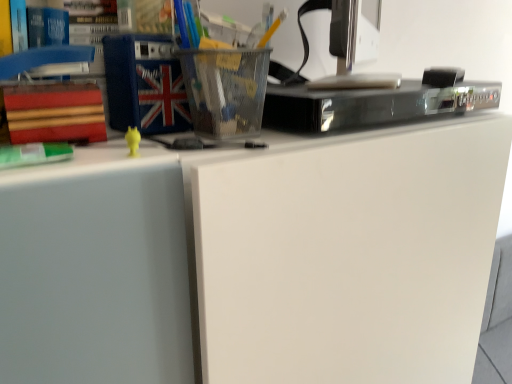
Question: From a real-world perspective, is blue fabric book at upper left, acting as the first paperback book starting from the top, above or below metallic silver desktop computer at upper right?

Choices:
 (A) above
 (B) below

Answer: (A)

Question: Looking at their shapes, would you say blue fabric book at upper left, the 2th paperback book when ordered from left to right, is wider or thinner than metallic silver desktop computer at upper right?

Choices:
 (A) thin
 (B) wide

Answer: (A)

Question: Based on their relative distances, which object is nearer to the blue fabric book at upper left, placed as the 1th paperback book when sorted from right to left?

Choices:
 (A) metallic silver desktop computer at upper right
 (B) green matte book at left
 (C) black glossy dvd player at upper center
 (D) red matte book at left, positioned as the 2th paperback book in top-to-bottom order

Answer: (D)

Question: Considering the real-world distances, which object is closest to the black glossy dvd player at upper center?

Choices:
 (A) blue fabric book at upper left, acting as the first paperback book starting from the top
 (B) green matte book at left
 (C) metallic silver desktop computer at upper right
 (D) red matte book at left, the first paperback book when ordered from left to right

Answer: (C)